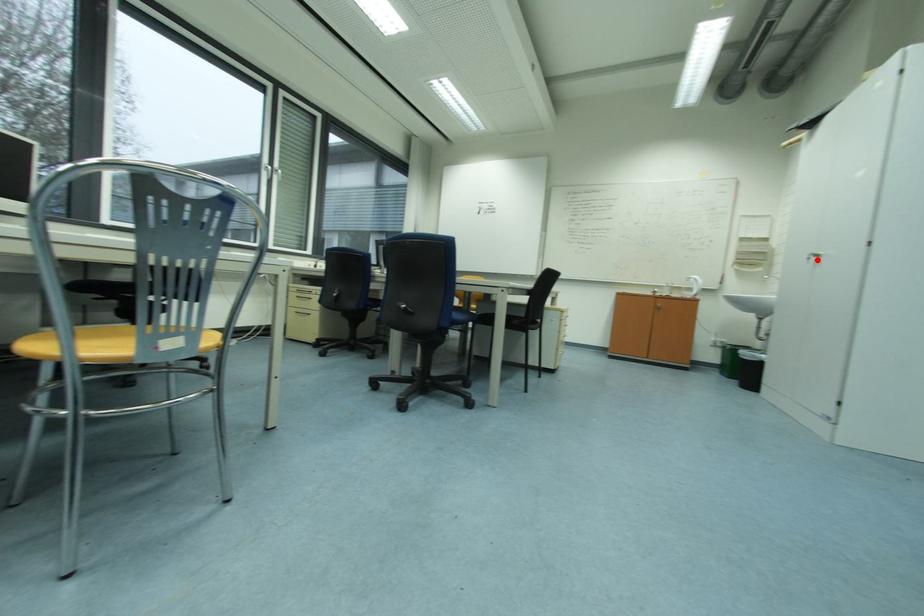
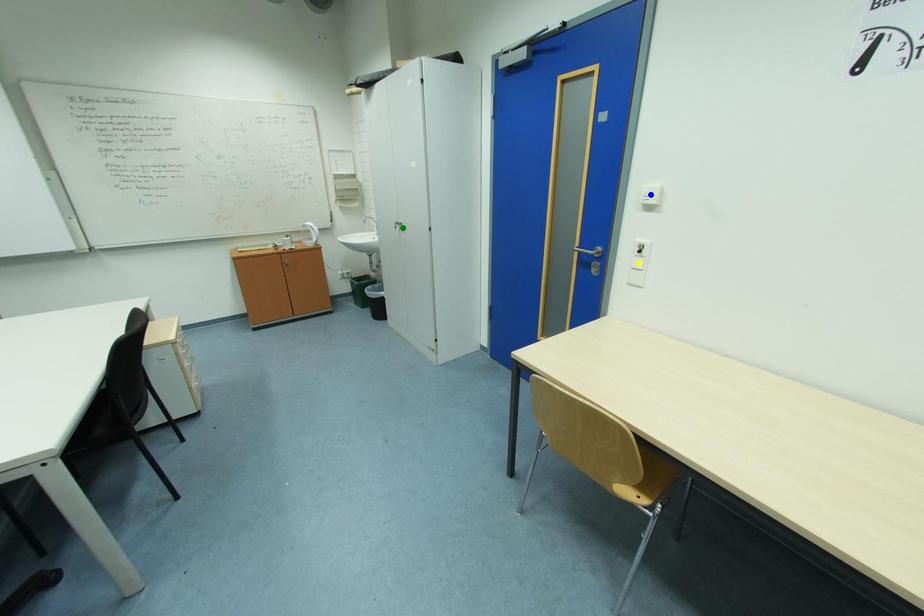
Question: I am providing you with two images of the same scene from different viewpoints. A red point is marked on the first image. You are given multiple points on the second image. Which spot in image 2 lines up with the point in image 1?

Choices:
 (A) yellow point
 (B) blue point
 (C) green point

Answer: (C)